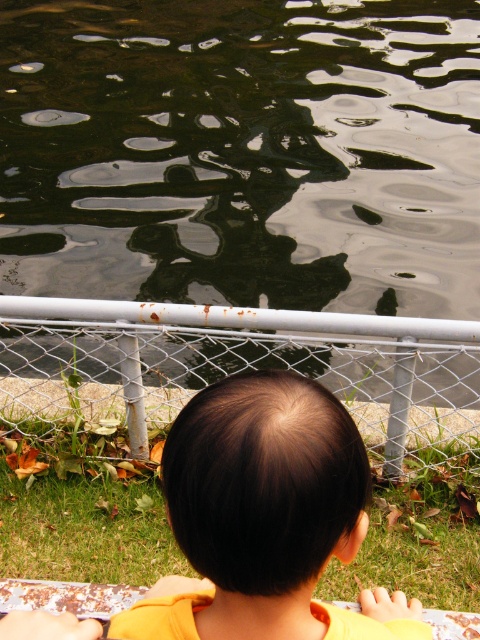
You are a photographer taking a picture of the child and the water. To ensure both the glossy water at upper center and the brown hair at center are in focus, where should you position your camera focus point?

The glossy water at upper center is located above the brown hair at center, so the camera focus point should be placed at the brown hair at center to ensure both are in focus since it is closer to the camera.

You are standing behind the child and want to place a small toy boat exactly at point (242,154) on the glossy water at upper center. Based on the scene description, can you confirm the location of this point?

The point (242,154) is on the glossy water at upper center, so placing the toy boat there would be on the reflective water surface in the upper central area of the image.

You are a photographer trying to capture the reflection of the rusty metal rail at center in the glossy water at upper center. Based on their positions, can you determine if the rail is visible in the water?

The glossy water at upper center is to the left of the rusty metal rail at center, so the rail is positioned to the right of the water. Since reflections typically mirror objects above them, the rail would only appear in the water if it is directly above it. Since the rail is to the right of the water, its reflection would not be visible in the water to the left. Therefore, the reflection of the rusty metal rail at center would not be visible in the glossy water at upper center.